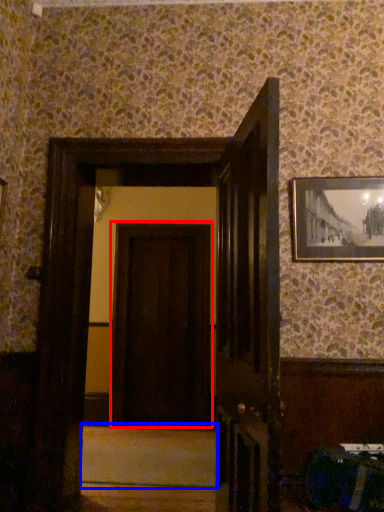
Question: Among these objects, which one is nearest to the camera, door (highlighted by a red box) or stair (highlighted by a blue box)?

Choices:
 (A) door
 (B) stair

Answer: (B)